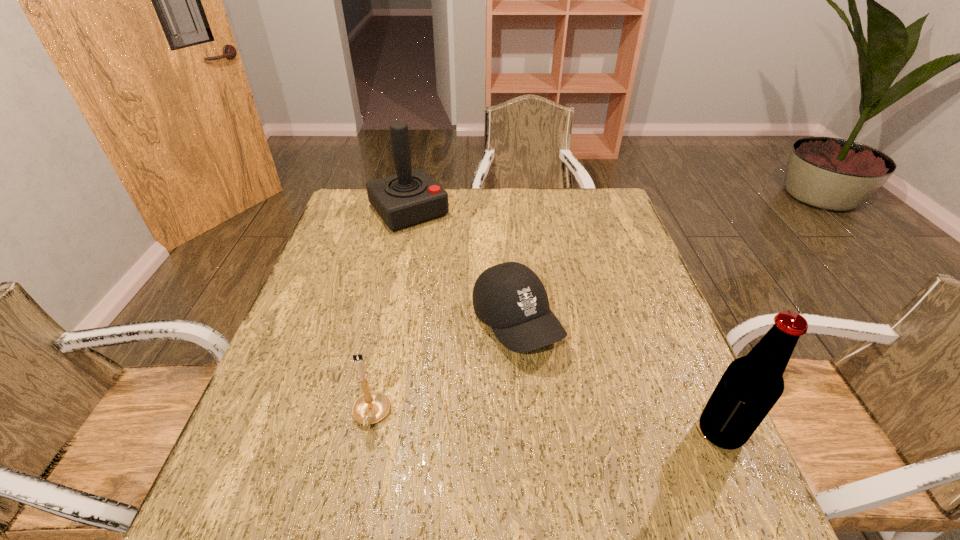
This screenshot has width=960, height=540. I want to click on candle holder, so click(x=371, y=407).

Where is `the rightmost object`? The width and height of the screenshot is (960, 540). the rightmost object is located at coordinates (751, 385).

Identify the location of joystick. Image resolution: width=960 pixels, height=540 pixels. (411, 197).

In order to click on the third nearest object in this screenshot , I will do `click(510, 298)`.

Find the location of a particular element. the third object from left to right is located at coordinates (510, 298).

The height and width of the screenshot is (540, 960). I want to click on free space located 0.140m on the back of the beer bottle, so click(687, 357).

This screenshot has width=960, height=540. I want to click on free space located 0.380m on the base of the joystick, so click(x=490, y=306).

Identify the location of vacant space located on the base of the joystick. This screenshot has height=540, width=960. (455, 265).

Identify the location of vacant point located on the base of the joystick. coord(474,287).

Where is `vacant area situated on the front-facing side of the third object from left to right`? vacant area situated on the front-facing side of the third object from left to right is located at coordinates (578, 414).